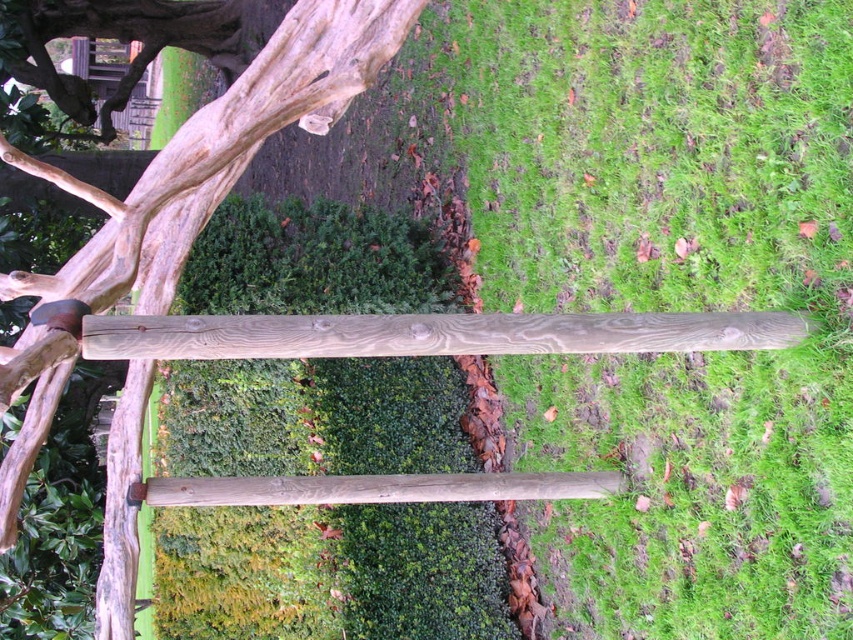
Between point (241, 630) and point (334, 17), which one is positioned in front?

Point (334, 17)

Describe the element at coordinates (331, 573) in the screenshot. I see `green textured hedge at center` at that location.

The image size is (853, 640). I want to click on green textured hedge at center, so click(331, 573).

Can you confirm if green grass at center is positioned below smooth brown wooden rail at center?

Actually, green grass at center is above smooth brown wooden rail at center.

Is green grass at center wider than smooth brown wooden rail at center?

Incorrect, green grass at center's width does not surpass smooth brown wooden rail at center's.

In order to click on green grass at center in this screenshot , I will do `click(672, 292)`.

Does green grass at center have a smaller size compared to gray wood rail at center?

Incorrect, green grass at center is not smaller in size than gray wood rail at center.

What do you see at coordinates (672, 292) in the screenshot?
I see `green grass at center` at bounding box center [672, 292].

Does point (843, 618) come farther from viewer compared to point (735, 346)?

No, it is in front of (735, 346).

The image size is (853, 640). I want to click on green grass at center, so click(x=672, y=292).